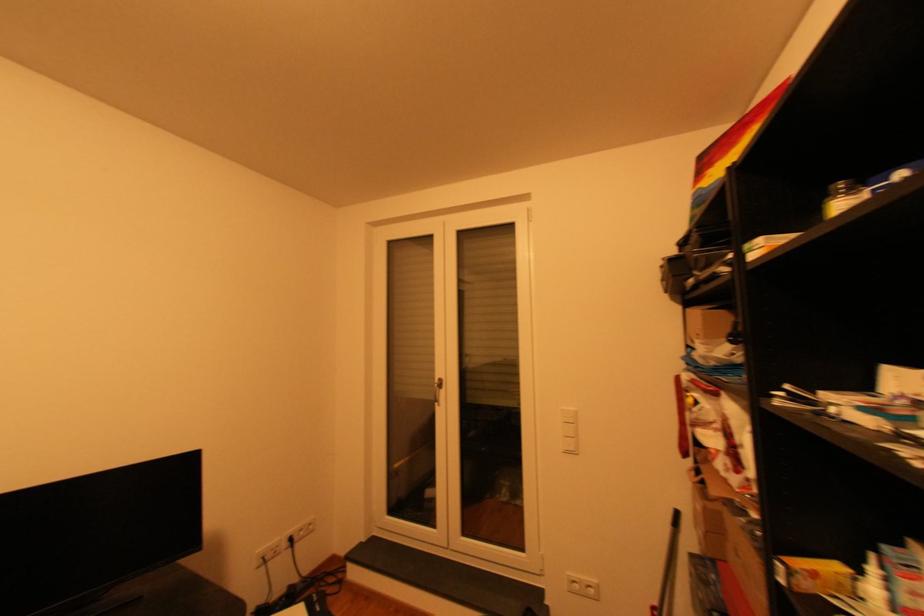
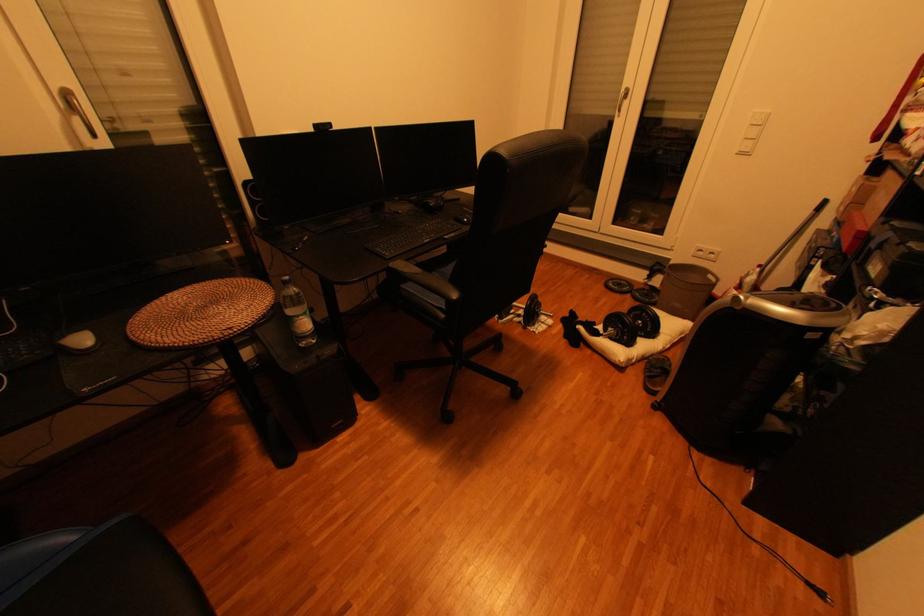
Where in the second image is the point corresponding to point (576, 453) from the first image?

(749, 155)